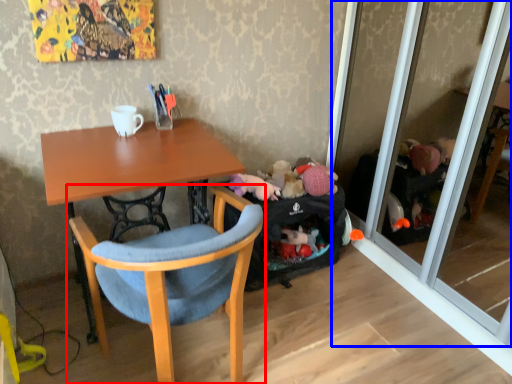
Question: Which object is further to the camera taking this photo, chair (highlighted by a red box) or screen door (highlighted by a blue box)?

Choices:
 (A) chair
 (B) screen door

Answer: (B)